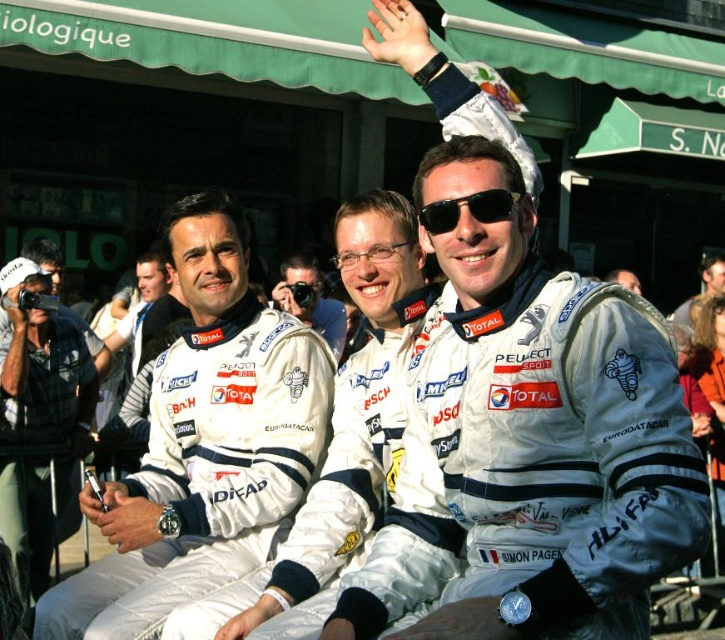
Question: Considering the relative positions of sunglasses at center and transparent plastic goggles at center in the image provided, where is sunglasses at center located with respect to transparent plastic goggles at center?

Choices:
 (A) above
 (B) below

Answer: (B)

Question: Where is sunglasses at center located in relation to white racing suit at center in the image?

Choices:
 (A) left
 (B) right

Answer: (A)

Question: Which of the following is the closest to the observer?

Choices:
 (A) white fabric racing suit at center
 (B) white racing suit at center

Answer: (A)

Question: Among these points, which one is farthest from the camera?

Choices:
 (A) [327, 525]
 (B) [720, 289]
 (C) [341, 264]

Answer: (B)

Question: Estimate the real-world distances between objects in this image. Which object is farther from the white fabric suit at center?

Choices:
 (A) white fabric racing suit at center
 (B) sunglasses at center

Answer: (B)

Question: Is white fabric racing suit at center below white fabric suit at center?

Choices:
 (A) no
 (B) yes

Answer: (A)